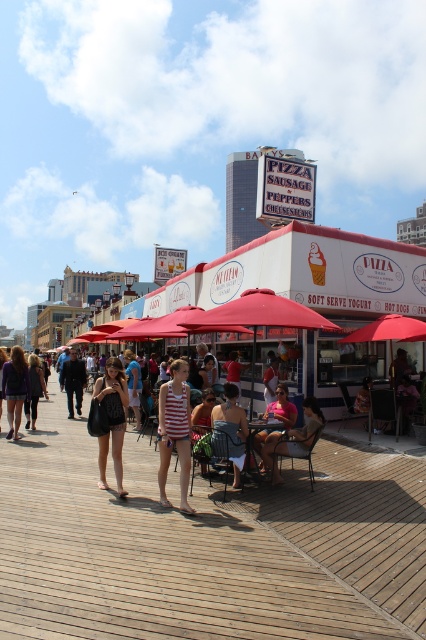
Question: Which is nearer to the matte black bag at center?

Choices:
 (A) wooden at center
 (B) denim shorts at center

Answer: (B)

Question: Observing the image, what is the correct spatial positioning of matte pink tank top at center in reference to dark blue jeans at center?

Choices:
 (A) right
 (B) left

Answer: (A)

Question: Is wooden at center to the right of dark blue jeans at center from the viewer's perspective?

Choices:
 (A) yes
 (B) no

Answer: (A)

Question: Which point is closer to the camera?

Choices:
 (A) (273, 433)
 (B) (83, 540)

Answer: (B)

Question: Which point is farther from the camera taking this photo?

Choices:
 (A) (267, 435)
 (B) (75, 364)
 (C) (304, 449)

Answer: (B)

Question: Can you confirm if striped fabric shorts at center is thinner than denim shorts at center?

Choices:
 (A) yes
 (B) no

Answer: (A)